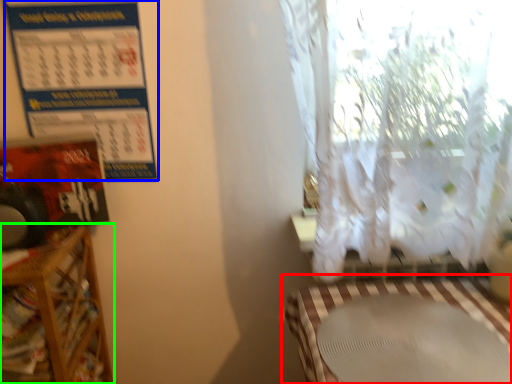
Question: Which object is the farthest from table (highlighted by a red box)? Choose among these: calendar (highlighted by a blue box) or furniture (highlighted by a green box).

Choices:
 (A) calendar
 (B) furniture

Answer: (A)